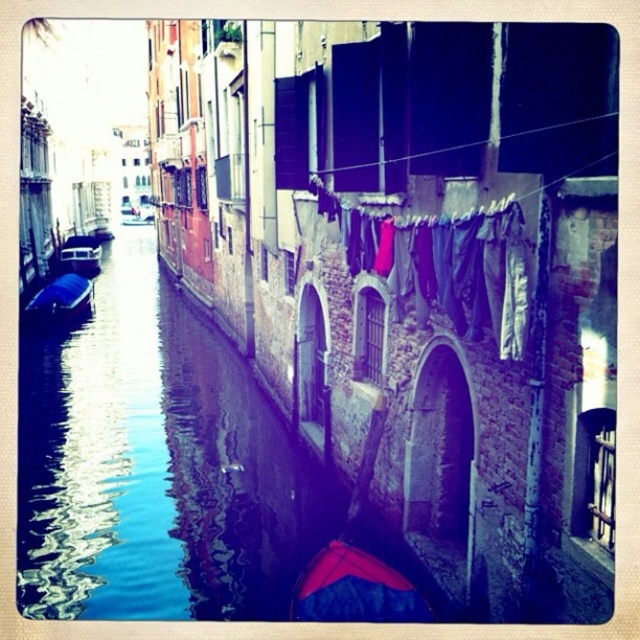
Question: Is the position of red fabric boat at lower center less distant than that of matte black boat at left?

Choices:
 (A) yes
 (B) no

Answer: (A)

Question: Does blue fabric boat at left appear under matte black boat at left?

Choices:
 (A) no
 (B) yes

Answer: (B)

Question: Which object is the farthest from the red fabric boat at lower center?

Choices:
 (A) matte black boat at left
 (B) multicolored fabric at center

Answer: (A)

Question: Which point is farther to the camera?

Choices:
 (A) blue fabric boat at left
 (B) matte black boat at left
 (C) multicolored fabric at center
 (D) red fabric boat at lower center

Answer: (B)

Question: Does blue fabric boat at left appear on the left side of matte black boat at left?

Choices:
 (A) no
 (B) yes

Answer: (A)

Question: Which object is the closest to the multicolored fabric at center?

Choices:
 (A) red fabric boat at lower center
 (B) matte black boat at left

Answer: (A)